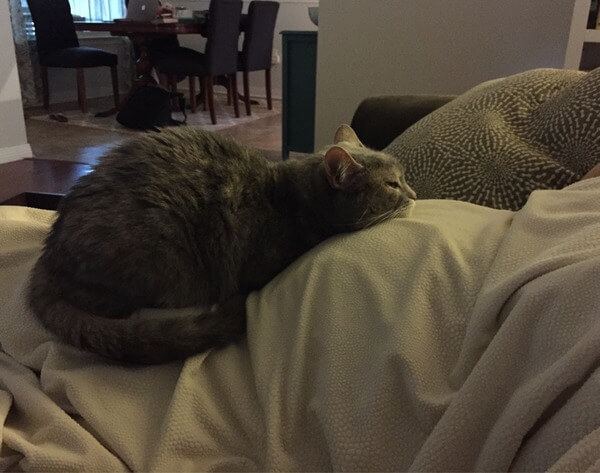
This screenshot has width=600, height=473. What are the coordinates of `floor` in the screenshot? It's located at (257, 130).